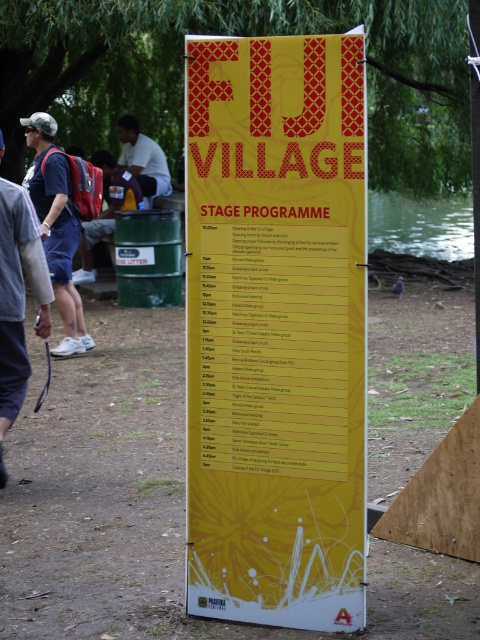
Question: Which point is closer to the camera?

Choices:
 (A) (16, 259)
 (B) (146, 202)

Answer: (A)

Question: Which point is farther to the camera?

Choices:
 (A) white matte shirt at upper center
 (B) yellow paper poster at center
 (C) matte blue shirt at left
 (D) matte blue shorts at left

Answer: (A)

Question: Can you confirm if matte blue shirt at left is positioned below white matte shirt at upper center?

Choices:
 (A) no
 (B) yes

Answer: (B)

Question: Is matte blue shorts at left to the right of matte blue shirt at left from the viewer's perspective?

Choices:
 (A) no
 (B) yes

Answer: (B)

Question: Can you confirm if yellow paper poster at center is thinner than matte blue shirt at left?

Choices:
 (A) no
 (B) yes

Answer: (A)

Question: Which object appears closest to the camera in this image?

Choices:
 (A) matte blue shorts at left
 (B) matte blue shirt at left

Answer: (A)